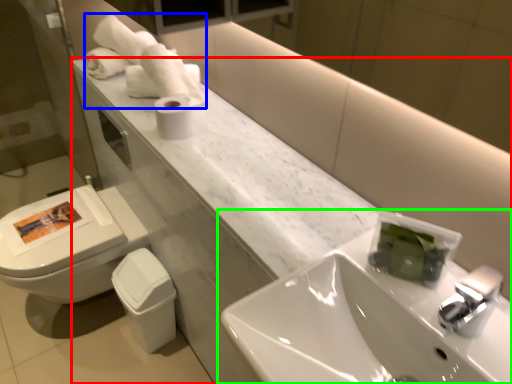
Question: Which is farther away from counter (highlighted by a red box)? bath towel (highlighted by a blue box) or sink (highlighted by a green box)?

Choices:
 (A) bath towel
 (B) sink

Answer: (A)